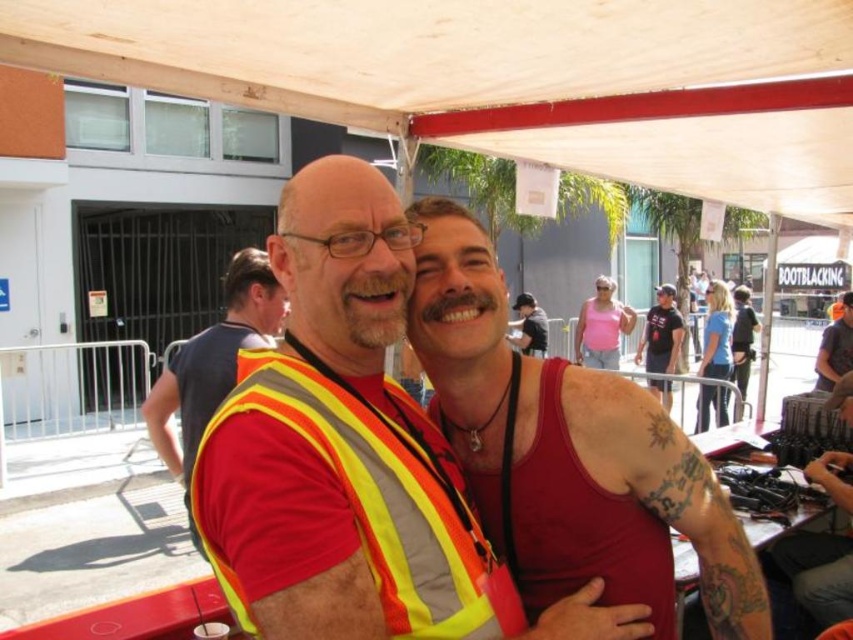
Looking at this image, does red tank top at center lie in front of pink fabric tank top at center?

Yes, it is in front of pink fabric tank top at center.

Does red tank top at center have a lesser width compared to pink fabric tank top at center?

Yes, red tank top at center is thinner than pink fabric tank top at center.

Is point (527, 417) less distant than point (732, 330)?

Yes, it is in front of point (732, 330).

At what (x,y) coordinates should I click in order to perform the action: click on red tank top at center. Please return your answer as a coordinate pair (x, y). Looking at the image, I should click on (567, 452).

Which is in front, point (722, 424) or point (834, 342)?

Positioned in front is point (834, 342).

Does pink fabric tank top at center have a greater height compared to matte black tank top at center?

Indeed, pink fabric tank top at center has a greater height compared to matte black tank top at center.

Is point (653, 348) positioned behind point (828, 339)?

Yes, it is behind point (828, 339).

You are a GUI agent. You are given a task and a screenshot of the screen. Output one action in this format:
    pyautogui.click(x=<x>, y=<y>)
    Task: Click on the pink fabric tank top at center
    This screenshot has width=853, height=640.
    Given the screenshot: What is the action you would take?
    pyautogui.click(x=715, y=356)

Can you confirm if reflective yellow safety vest at center is bigger than pink fabric tank top at center?

Incorrect, reflective yellow safety vest at center is not larger than pink fabric tank top at center.

The image size is (853, 640). What do you see at coordinates (374, 499) in the screenshot?
I see `reflective yellow safety vest at center` at bounding box center [374, 499].

Based on the photo, who is more forward, (402, 499) or (708, 348)?

Point (402, 499) is in front.

At what (x,y) coordinates should I click in order to perform the action: click on reflective yellow safety vest at center. Please return your answer as a coordinate pair (x, y). Looking at the image, I should click on (374, 499).